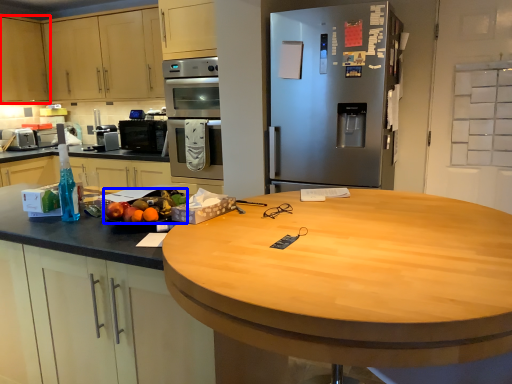
Question: Which object appears farthest to the camera in this image, cabinetry (highlighted by a red box) or fruit (highlighted by a blue box)?

Choices:
 (A) cabinetry
 (B) fruit

Answer: (A)